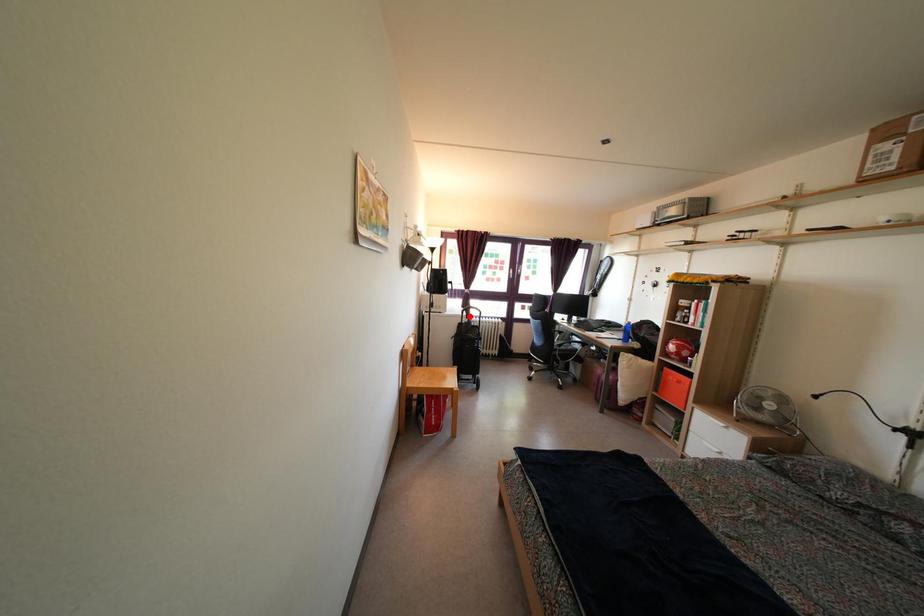
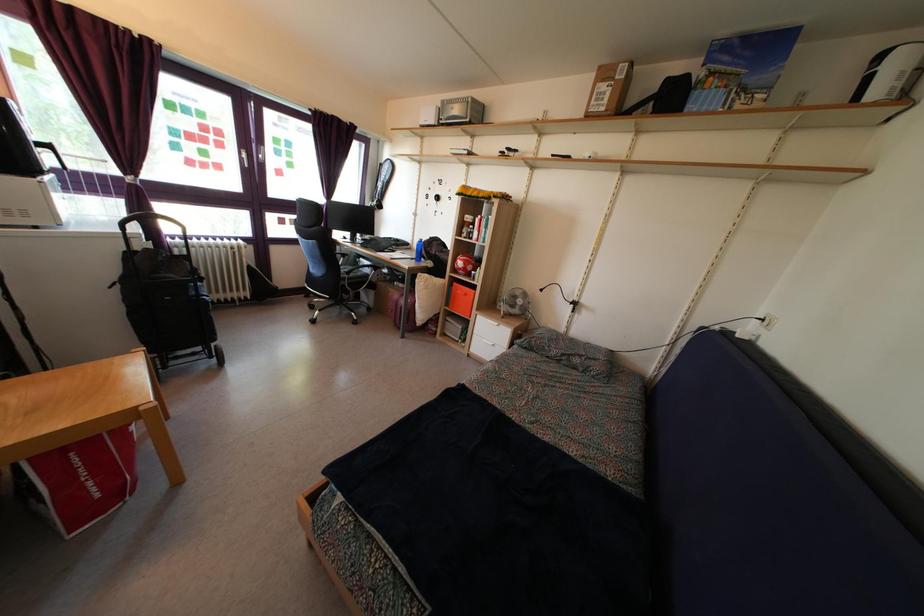
The point at the highlighted location is marked in the first image. Where is the corresponding point in the second image?

(146, 225)